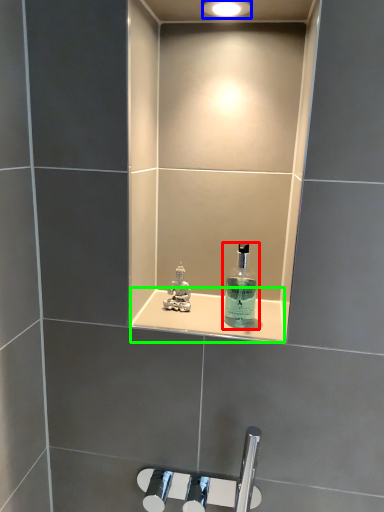
Question: Which object is the farthest from bottle (highlighted by a red box)? Choose among these: light fixture (highlighted by a blue box) or ledge (highlighted by a green box).

Choices:
 (A) light fixture
 (B) ledge

Answer: (A)